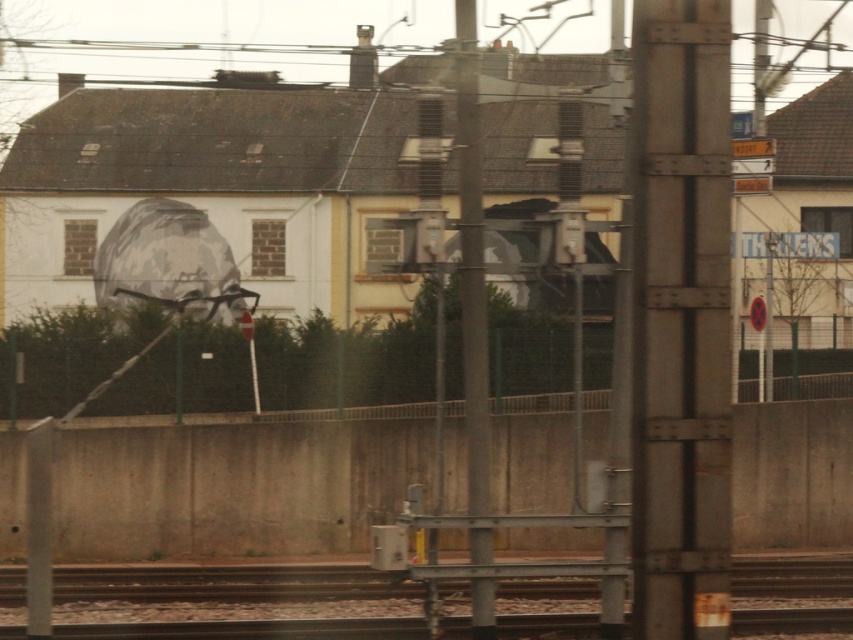
Question: Which point is closer to the camera taking this photo?

Choices:
 (A) (466, 410)
 (B) (685, 512)

Answer: (B)

Question: Which object is closer to the camera taking this photo?

Choices:
 (A) metallic gray pole at center
 (B) rusty metal pole at center

Answer: (B)

Question: Can you confirm if smooth metal train track at center is bigger than metallic gray pole at center?

Choices:
 (A) yes
 (B) no

Answer: (A)

Question: Is rusty metal pole at center below metallic gray pole at center?

Choices:
 (A) no
 (B) yes

Answer: (B)

Question: Which is nearer to the metallic gray pole at center?

Choices:
 (A) rusty metal pole at center
 (B) smooth metal train track at center

Answer: (B)

Question: Is rusty metal pole at center closer to the viewer compared to smooth metal train track at center?

Choices:
 (A) yes
 (B) no

Answer: (A)